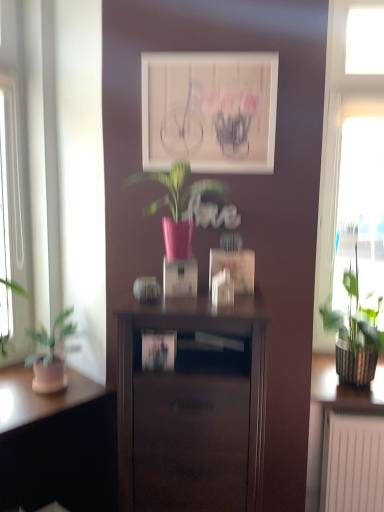
Locate an element on the screen. The height and width of the screenshot is (512, 384). pink glossy vase at center, the 2th houseplant when ordered from right to left is located at coordinates (176, 206).

Image resolution: width=384 pixels, height=512 pixels. Describe the element at coordinates (209, 111) in the screenshot. I see `matte white picture frame at center` at that location.

Based on the photo, what is the approximate width of green textured plant at right, which appears as the 1th houseplant when viewed from the back?

green textured plant at right, which appears as the 1th houseplant when viewed from the back, is 12.15 inches in width.

What do you see at coordinates (192, 409) in the screenshot? I see `dark wood nightstand at center` at bounding box center [192, 409].

Find the location of a particular element. The width and height of the screenshot is (384, 512). transparent glass window at right is located at coordinates (351, 158).

Where is `pink glossy vase at center, the 2th houseplant positioned from the bottom`? This screenshot has height=512, width=384. pink glossy vase at center, the 2th houseplant positioned from the bottom is located at coordinates (176, 206).

Which object is positioned more to the right, matte wood desk at lower left or pink glossy vase at center, the 2th houseplant positioned from the bottom?

Positioned to the right is pink glossy vase at center, the 2th houseplant positioned from the bottom.

Consider the image. Is matte wood desk at lower left not inside pink glossy vase at center, placed as the 1th houseplant when sorted from left to right?

Yes, matte wood desk at lower left is outside of pink glossy vase at center, placed as the 1th houseplant when sorted from left to right.

Starting from the matte wood desk at lower left, which houseplant is the 1st one to the right? Please provide its 2D coordinates.

[(176, 206)]

Which of these two, matte wood desk at lower left or pink glossy vase at center, marked as the 2th houseplant in a back-to-front arrangement, is smaller?

Smaller between the two is pink glossy vase at center, marked as the 2th houseplant in a back-to-front arrangement.

How different are the orientations of transparent glass window at right and green textured plant at right, which is counted as the 2th houseplant, starting from the front, in degrees?

There is a 0.000161-degree angle between the facing directions of transparent glass window at right and green textured plant at right, which is counted as the 2th houseplant, starting from the front.

Is transparent glass window at right touching green textured plant at right, which is counted as the 2th houseplant, starting from the left?

transparent glass window at right is not next to green textured plant at right, which is counted as the 2th houseplant, starting from the left, and they're not touching.

Is transparent glass window at right positioned with its back to green textured plant at right, which is counted as the 2th houseplant, starting from the left?

No, transparent glass window at right is not facing the opposite direction of green textured plant at right, which is counted as the 2th houseplant, starting from the left.

Considering the relative sizes of green textured plant at right, which is counted as the 2th houseplant, starting from the front, and transparent glass window at right in the image provided, is green textured plant at right, which is counted as the 2th houseplant, starting from the front, smaller than transparent glass window at right?

Yes.

Does green textured plant at right, the 1th houseplant viewed from the right, touch transparent glass window at right?

No, green textured plant at right, the 1th houseplant viewed from the right, is not in contact with transparent glass window at right.

Identify the location of window behind the green textured plant at right, which appears as the 1th houseplant when viewed from the back. pos(351,158).

Looking at this image, from a real-world perspective, is green textured plant at right, which appears as the 1th houseplant when viewed from the back, physically located above or below matte white picture frame at center?

Clearly, from a real-world perspective, green textured plant at right, which appears as the 1th houseplant when viewed from the back, is below matte white picture frame at center.

From the picture: Which is in front, green textured plant at right, which appears as the 1th houseplant when viewed from the back, or matte white picture frame at center?

Positioned in front is matte white picture frame at center.

Considering the sizes of green textured plant at right, which is counted as the 2th houseplant, starting from the front, and matte white picture frame at center in the image, is green textured plant at right, which is counted as the 2th houseplant, starting from the front, bigger or smaller than matte white picture frame at center?

Clearly, green textured plant at right, which is counted as the 2th houseplant, starting from the front, is larger in size than matte white picture frame at center.

Does green textured plant at right, which is counted as the 2th houseplant, starting from the front, appear on the left side of matte white picture frame at center?

In fact, green textured plant at right, which is counted as the 2th houseplant, starting from the front, is to the right of matte white picture frame at center.

Image resolution: width=384 pixels, height=512 pixels. In order to click on desk directly beneath the green textured plant at right, which appears as the 1th houseplant when viewed from the back (from a real-world perspective) in this screenshot , I will do `click(57, 444)`.

From the image's perspective, which object appears higher, green textured plant at right, which appears as the 1th houseplant when viewed from the back, or matte wood desk at lower left?

From the image's view, green textured plant at right, which appears as the 1th houseplant when viewed from the back, is above.

Based on the photo, considering the relative sizes of green textured plant at right, which is counted as the 2th houseplant, starting from the front, and matte wood desk at lower left in the image provided, is green textured plant at right, which is counted as the 2th houseplant, starting from the front, smaller than matte wood desk at lower left?

Correct, green textured plant at right, which is counted as the 2th houseplant, starting from the front, occupies less space than matte wood desk at lower left.

Is green textured plant at right, placed as the 2th houseplant when sorted from top to bottom, in front of or behind matte wood desk at lower left in the image?

green textured plant at right, placed as the 2th houseplant when sorted from top to bottom, is behind matte wood desk at lower left.

This screenshot has width=384, height=512. I want to click on nightstand on the left of the matte white picture frame at center, so click(x=192, y=409).

Choose the correct answer: Is dark wood nightstand at center inside matte white picture frame at center or outside it?

dark wood nightstand at center exists outside the volume of matte white picture frame at center.

Are dark wood nightstand at center and matte white picture frame at center far apart?

Actually, dark wood nightstand at center and matte white picture frame at center are a little close together.

From the image's perspective, who appears lower, dark wood nightstand at center or matte white picture frame at center?

dark wood nightstand at center.

Where is `nightstand that is on the right side of pink glossy vase at center, placed as the 1th houseplant when sorted from left to right`? nightstand that is on the right side of pink glossy vase at center, placed as the 1th houseplant when sorted from left to right is located at coordinates (192, 409).

Can you confirm if pink glossy vase at center, the 2th houseplant positioned from the bottom, is wider than dark wood nightstand at center?

In fact, pink glossy vase at center, the 2th houseplant positioned from the bottom, might be narrower than dark wood nightstand at center.

How distant is pink glossy vase at center, positioned as the 1th houseplant in front-to-back order, from dark wood nightstand at center?

19.79 inches.

Does pink glossy vase at center, the 2th houseplant positioned from the bottom, appear on the left side of dark wood nightstand at center?

Correct, you'll find pink glossy vase at center, the 2th houseplant positioned from the bottom, to the left of dark wood nightstand at center.

This screenshot has width=384, height=512. Find the location of `desk on the left side of pink glossy vase at center, placed as the 1th houseplant when sorted from left to right`. desk on the left side of pink glossy vase at center, placed as the 1th houseplant when sorted from left to right is located at coordinates (57, 444).

The width and height of the screenshot is (384, 512). Identify the location of window on the right side of green textured plant at right, placed as the 2th houseplant when sorted from top to bottom. (351, 158).

From the image, which object appears to be nearer to pink glossy vase at center, placed as the 1th houseplant when sorted from left to right, transparent glass window at right or dark wood nightstand at center?

dark wood nightstand at center.

From the image, which object appears to be farther from transparent glass window at right, pink glossy vase at center, the 1th houseplant from the top, or dark wood nightstand at center?

dark wood nightstand at center is positioned further to the anchor transparent glass window at right.

Based on their spatial positions, is dark wood nightstand at center or green textured plant at right, which is counted as the 2th houseplant, starting from the left, further from matte wood desk at lower left?

green textured plant at right, which is counted as the 2th houseplant, starting from the left.

Based on their spatial positions, is pink glossy vase at center, the 2th houseplant positioned from the bottom, or matte wood desk at lower left closer to transparent glass window at right?

Among the two, pink glossy vase at center, the 2th houseplant positioned from the bottom, is located nearer to transparent glass window at right.

Based on their spatial positions, is matte white picture frame at center or green textured plant at right, the first houseplant positioned from the bottom, closer to pink glossy vase at center, the 2th houseplant positioned from the bottom?

matte white picture frame at center.

Considering their positions, is matte white picture frame at center positioned further to dark wood nightstand at center than green textured plant at right, which is counted as the 2th houseplant, starting from the left?

Among the two, matte white picture frame at center is located further to dark wood nightstand at center.

Based on their spatial positions, is pink glossy vase at center, positioned as the 1th houseplant in front-to-back order, or matte white picture frame at center closer to matte wood desk at lower left?

Among the two, pink glossy vase at center, positioned as the 1th houseplant in front-to-back order, is located nearer to matte wood desk at lower left.

Considering their positions, is matte wood desk at lower left positioned further to matte white picture frame at center than dark wood nightstand at center?

The object further to matte white picture frame at center is matte wood desk at lower left.

Identify the location of nightstand located between matte wood desk at lower left and transparent glass window at right in the left-right direction. Image resolution: width=384 pixels, height=512 pixels. (x=192, y=409).

Where is `window between matte white picture frame at center and matte wood desk at lower left in the up-down direction`? The width and height of the screenshot is (384, 512). window between matte white picture frame at center and matte wood desk at lower left in the up-down direction is located at coordinates (351, 158).

This screenshot has width=384, height=512. In order to click on nightstand between matte wood desk at lower left and green textured plant at right, placed as the 2th houseplant when sorted from top to bottom in this screenshot , I will do `click(192, 409)`.

You are a GUI agent. You are given a task and a screenshot of the screen. Output one action in this format:
    pyautogui.click(x=<x>, y=<y>)
    Task: Click on the picture frame between pink glossy vase at center, the 2th houseplant when ordered from right to left, and transparent glass window at right
    
    Given the screenshot: What is the action you would take?
    pyautogui.click(x=209, y=111)